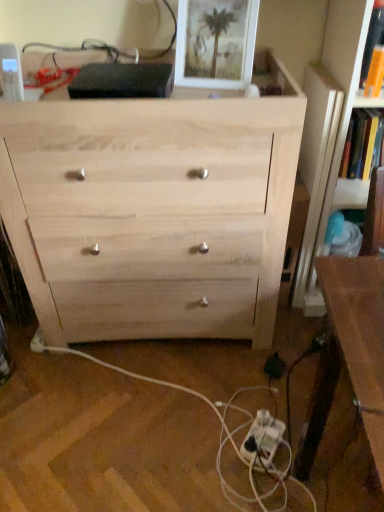
This screenshot has height=512, width=384. I want to click on unoccupied region to the right of white plastic extension cord at lower center, so pos(316,448).